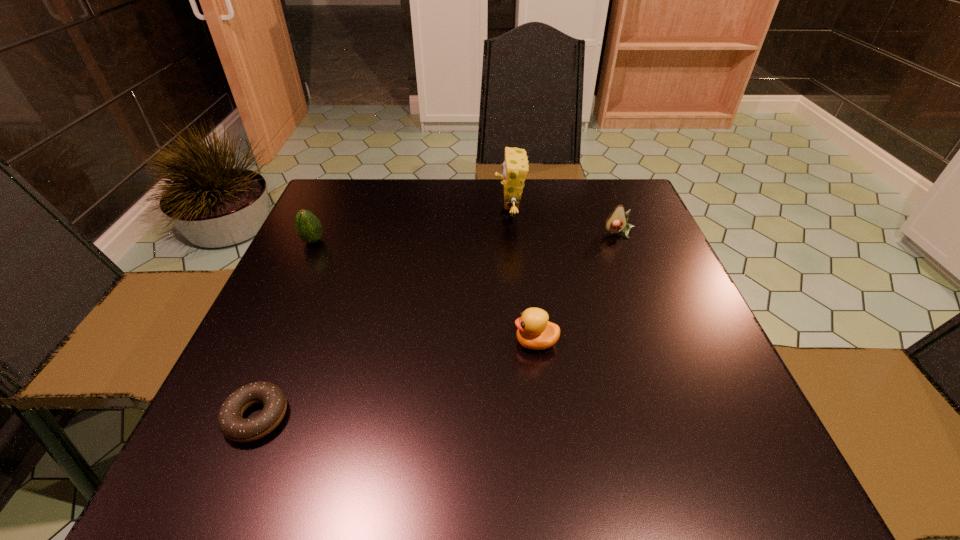
Locate an element on the screen. This screenshot has height=540, width=960. vacant region located on the seed side of the rightmost object is located at coordinates (646, 302).

Locate an element on the screen. Image resolution: width=960 pixels, height=540 pixels. blank space located 0.320m on the face of the fourth farthest object is located at coordinates (346, 342).

The width and height of the screenshot is (960, 540). What are the coordinates of `free spot located on the face of the fourth farthest object` in the screenshot? It's located at (477, 342).

The image size is (960, 540). Find the location of `free region located 0.080m on the face of the fourth farthest object`. free region located 0.080m on the face of the fourth farthest object is located at coordinates (471, 342).

I want to click on vacant area located on the back of the nearest object, so [317, 272].

The width and height of the screenshot is (960, 540). I want to click on object situated at the far edge, so click(x=515, y=167).

In order to click on object at the near edge in this screenshot , I will do `click(232, 425)`.

I want to click on avocado that is at the left edge, so click(x=309, y=228).

Image resolution: width=960 pixels, height=540 pixels. What are the coordinates of `doughnut positioned at the left edge` in the screenshot? It's located at (232, 425).

The height and width of the screenshot is (540, 960). I want to click on object present at the right edge, so click(616, 222).